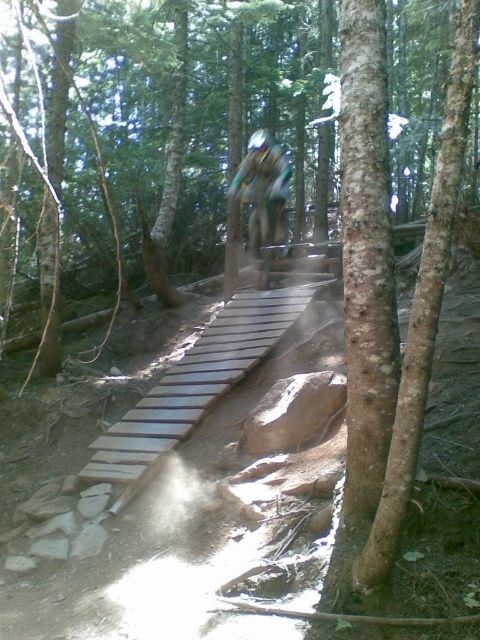
Question: Which point is farther to the camera?

Choices:
 (A) (274, 182)
 (B) (251, 317)

Answer: (A)

Question: Which object is farther from the camera taking this photo?

Choices:
 (A) camouflage fabric jacket at center
 (B) light brown wooden ramp at center

Answer: (A)

Question: Where is light brown wooden ramp at center located in relation to camouflage fabric jacket at center in the image?

Choices:
 (A) above
 (B) below

Answer: (B)

Question: Is light brown wooden ramp at center further to camera compared to camouflage fabric jacket at center?

Choices:
 (A) no
 (B) yes

Answer: (A)

Question: In this image, where is light brown wooden ramp at center located relative to camouflage fabric jacket at center?

Choices:
 (A) below
 (B) above

Answer: (A)